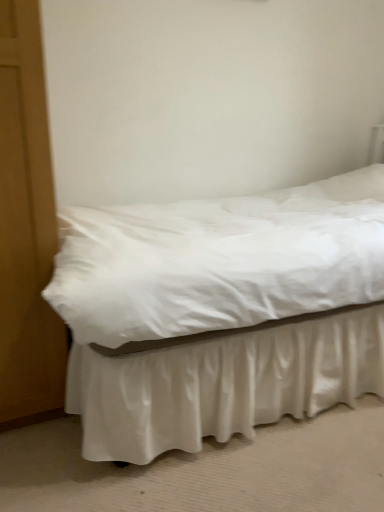
Question: Looking at the image, does white satin bed at center seem bigger or smaller compared to satin white bed frame at lower center?

Choices:
 (A) big
 (B) small

Answer: (A)

Question: Is white satin bed at center inside the boundaries of satin white bed frame at lower center, or outside?

Choices:
 (A) outside
 (B) inside

Answer: (A)

Question: From the image's perspective, relative to satin white bed frame at lower center, is white satin bed at center above or below?

Choices:
 (A) above
 (B) below

Answer: (A)

Question: Does point (193, 394) appear closer or farther from the camera than point (233, 356)?

Choices:
 (A) farther
 (B) closer

Answer: (B)

Question: Looking at the image, does satin white bed frame at lower center seem bigger or smaller compared to white satin bed at center?

Choices:
 (A) big
 (B) small

Answer: (B)

Question: From a real-world perspective, relative to white satin bed at center, is satin white bed frame at lower center vertically above or below?

Choices:
 (A) below
 (B) above

Answer: (A)

Question: Which is correct: satin white bed frame at lower center is inside white satin bed at center, or outside of it?

Choices:
 (A) inside
 (B) outside

Answer: (B)